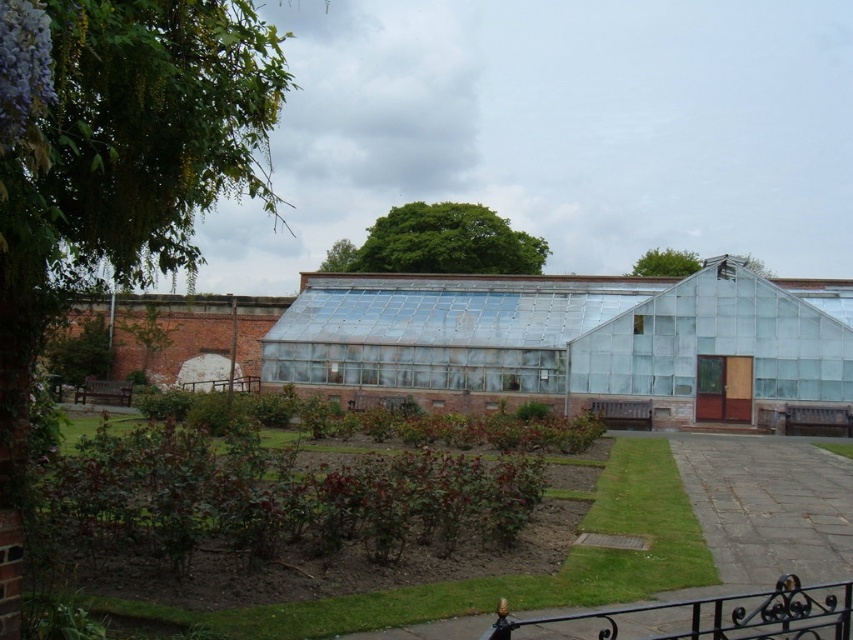
Question: Can you confirm if green leafy plants at center is smaller than transparent glass conservatory at center?

Choices:
 (A) no
 (B) yes

Answer: (B)

Question: From the image, what is the correct spatial relationship of transparent glass conservatory at center in relation to green leafy plant at center?

Choices:
 (A) above
 (B) below

Answer: (A)

Question: Which point is farther from the camera taking this photo?

Choices:
 (A) (262, 356)
 (B) (189, 600)

Answer: (A)

Question: Which object appears farthest from the camera in this image?

Choices:
 (A) transparent glass conservatory at center
 (B) green leafy plants at center

Answer: (A)

Question: Which of the following is the farthest from the observer?

Choices:
 (A) (659, 563)
 (B) (440, 381)

Answer: (B)

Question: Does green leafy plants at center appear over transparent glass conservatory at center?

Choices:
 (A) yes
 (B) no

Answer: (B)